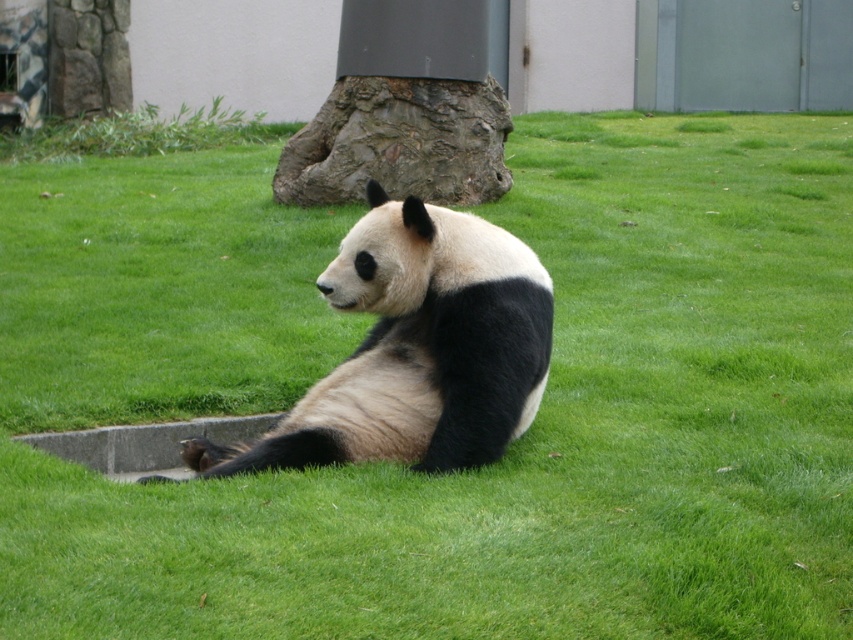
Question: Can you confirm if black fur panda at center is positioned to the right of rough bark tree trunk at center?

Choices:
 (A) yes
 (B) no

Answer: (B)

Question: Which object is closer to the camera taking this photo?

Choices:
 (A) black fur panda at center
 (B) rough bark tree trunk at center

Answer: (A)

Question: Does black fur panda at center appear over rough bark tree trunk at center?

Choices:
 (A) no
 (B) yes

Answer: (A)

Question: Which of the following is the farthest from the observer?

Choices:
 (A) rough bark tree trunk at center
 (B) black fur panda at center

Answer: (A)

Question: Is black fur panda at center behind rough bark tree trunk at center?

Choices:
 (A) no
 (B) yes

Answer: (A)

Question: Which point is closer to the camera?

Choices:
 (A) rough bark tree trunk at center
 (B) black fur panda at center

Answer: (B)